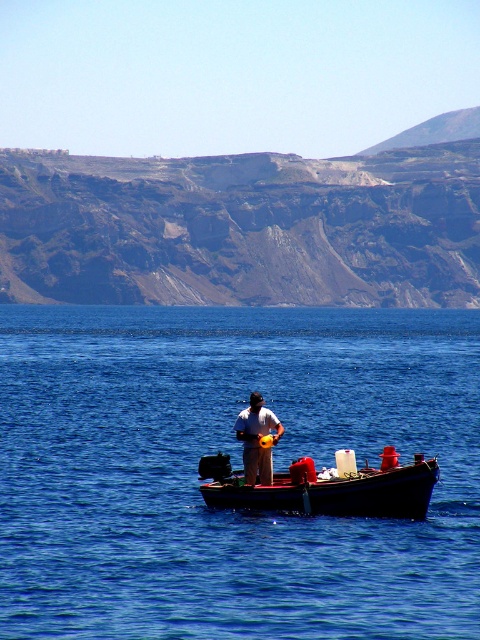
You are a sailor on the wooden boat at center and want to see the blue water at center. In which direction should you look from your position on the boat?

The blue water at center is in front of the wooden boat at center, so you should look forward to see the blue water at center.